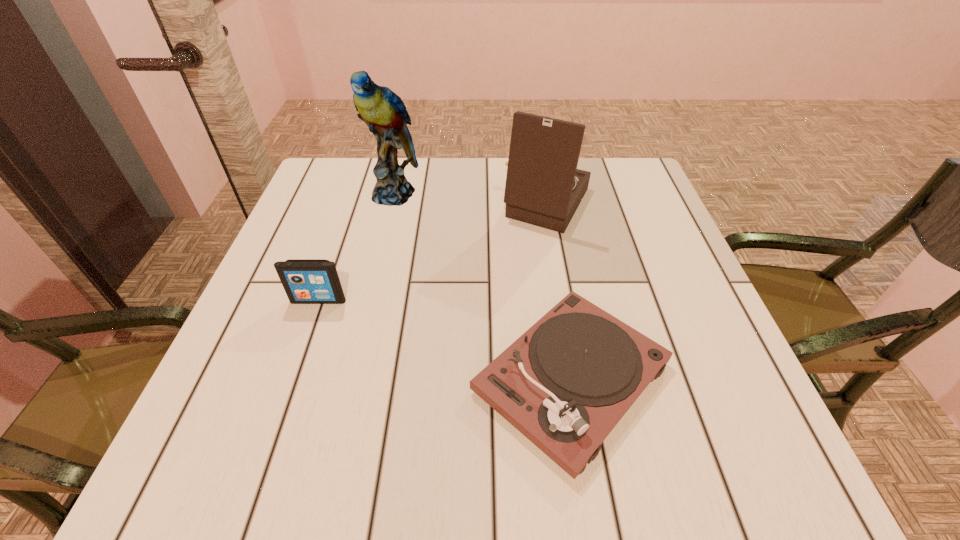
This screenshot has width=960, height=540. I want to click on free space that satisfies the following two spatial constraints: 1. on the face of the shortest object; 2. on the left side of the parrot, so [x=349, y=378].

Find the location of a particular element. This screenshot has height=540, width=960. vacant position in the image that satisfies the following two spatial constraints: 1. on the front screen of the second shortest object; 2. on the left side of the shortest object is located at coordinates (292, 378).

At what (x,y) coordinates should I click in order to perform the action: click on vacant space that satisfies the following two spatial constraints: 1. on the face of the tallest object; 2. on the left side of the shortest object. Please return your answer as a coordinate pair (x, y). The height and width of the screenshot is (540, 960). Looking at the image, I should click on (349, 378).

The width and height of the screenshot is (960, 540). I want to click on vacant region that satisfies the following two spatial constraints: 1. on the face of the shortest object; 2. on the left side of the parrot, so click(x=349, y=378).

This screenshot has height=540, width=960. I want to click on free space that satisfies the following two spatial constraints: 1. on the face of the nearer phonograph_record; 2. on the right side of the tallest object, so click(x=349, y=378).